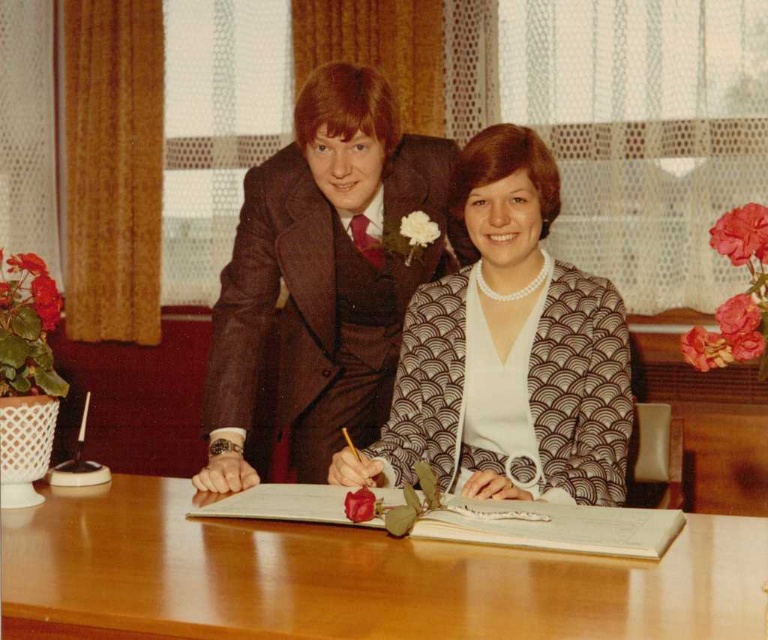
Consider the image. You are a photographer at a wedding ceremony. You need to capture a closeup shot of the two people signing a document. The minimum distance required for your camera lens to focus properly is 15 inches. Based on the scene, will your camera be able to focus on both the brown textured suit at center and the brown textured blazer at center clearly?

The brown textured suit at center and brown textured blazer at center are 14.98 inches apart from each other. Since the minimum focusing distance required is 15 inches, the camera cannot focus on both clearly as the distance between them is less than the required distance.

You are a photographer at a signing ceremony. You need to focus your camera on both points labeled as point (435, 616) and point (462, 385). Since they are at different distances from the camera, which point should you focus on first to ensure both are in sharp focus?

Point (435, 616) is closer to the camera than point (462, 385). To ensure both are in focus, focus on point (435, 616) first, then adjust slightly towards point (462, 385) since it is further away.

You are a photographer standing behind the wooden table at center and the brown textured blazer at center. You want to place a camera on the table so that it is level with the blazer. Is the table high enough for this?

The wooden table at center is not as tall as the brown textured blazer at center, so placing the camera on the table would not make it level with the blazer since the table is shorter.